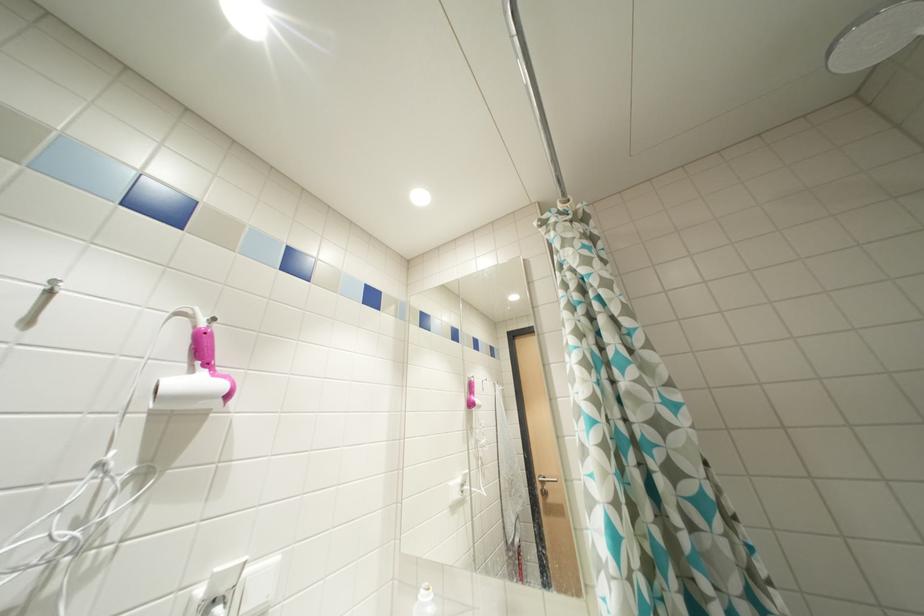
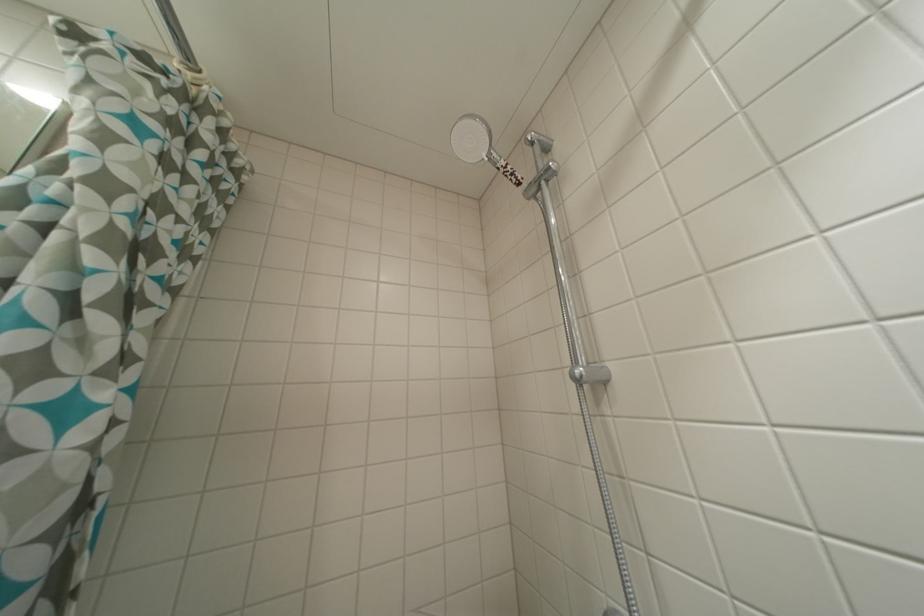
Question: The images are taken continuously from a first-person perspective. In which direction is your viewpoint rotating?

Choices:
 (A) Left
 (B) Right
 (C) Up
 (D) Down

Answer: (B)